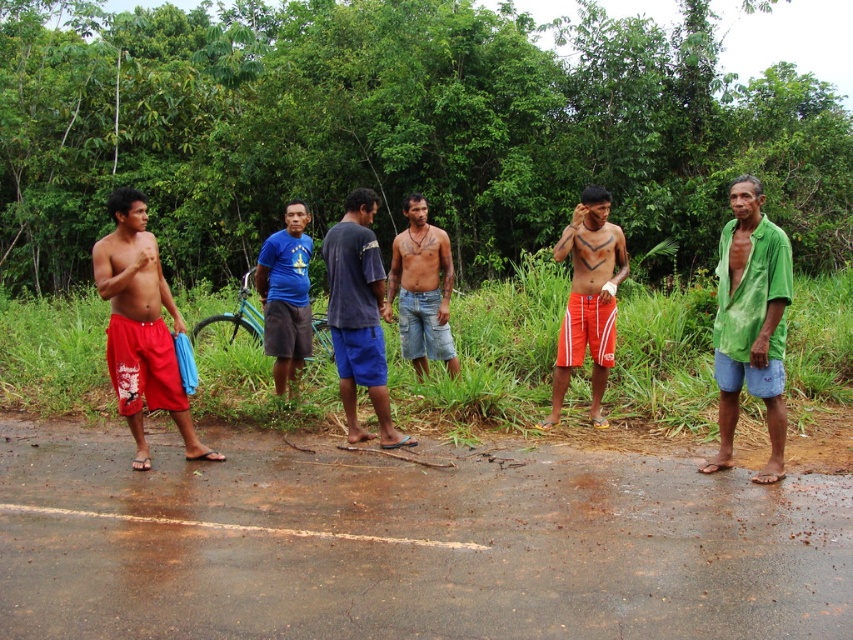
This screenshot has width=853, height=640. What do you see at coordinates (141, 326) in the screenshot? I see `red cotton shorts at left` at bounding box center [141, 326].

Locate an element on the screen. The image size is (853, 640). red cotton shorts at left is located at coordinates (x=141, y=326).

Where is `red cotton shorts at left`? red cotton shorts at left is located at coordinates (141, 326).

Is green satin shirt at right closer to camera compared to blue denim shorts at center?

That is True.

Is point (769, 349) positioned behind point (427, 340)?

No, it is not.

This screenshot has width=853, height=640. I want to click on green satin shirt at right, so coord(750,323).

From the picture: Is green satin shirt at right taller than blue fabric shirt at center?

Indeed, green satin shirt at right has a greater height compared to blue fabric shirt at center.

Is point (729, 250) positioned after point (300, 342)?

That is False.

Who is more forward, (747, 358) or (294, 378)?

Point (747, 358) is more forward.

In order to click on green satin shirt at right in this screenshot , I will do `click(750, 323)`.